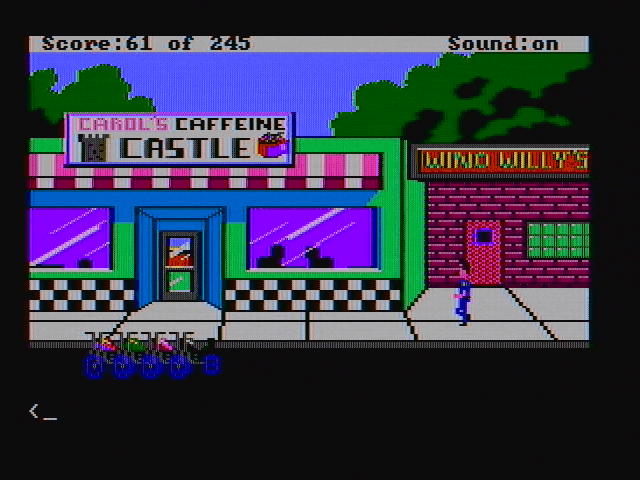
Find the location of a particular element. This screenshot has height=480, width=640. light gray floor is located at coordinates (377, 330).